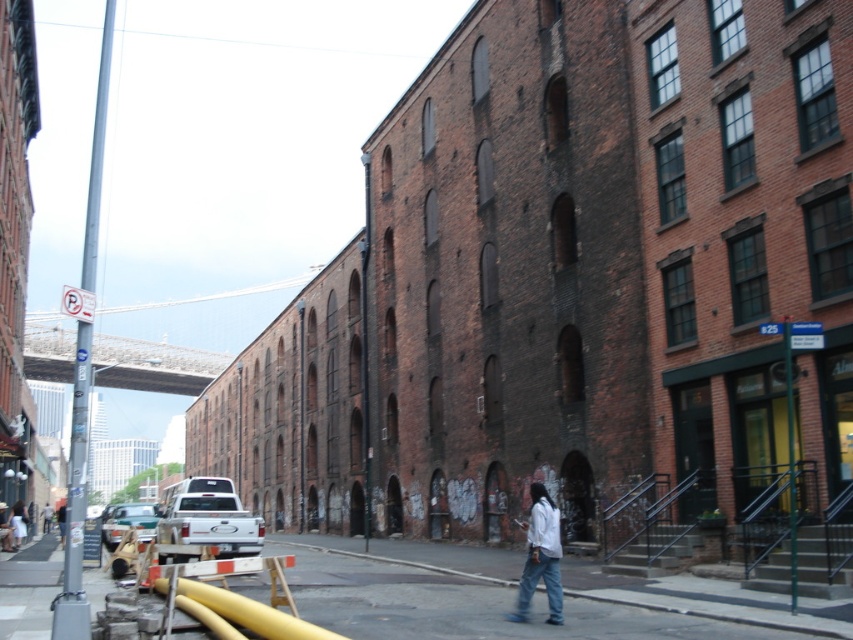
You are a delivery person who needs to park your vehicle on the smooth asphalt road at center. The parking spot is located at coordinates point 0.934, 0.594. Can you safely park your vehicle there?

Yes, the smooth asphalt road at center is located at point (x=506, y=596), so you can safely park your vehicle there.

You are a delivery person trying to navigate through the urban street scene. You need to pass between the smooth asphalt road at center and the white matte shirt at center. Can your delivery cart, which is 1.2 meters wide, fit through the space between them?

The smooth asphalt road at center is wider than the white matte shirt at center, but the exact width isn